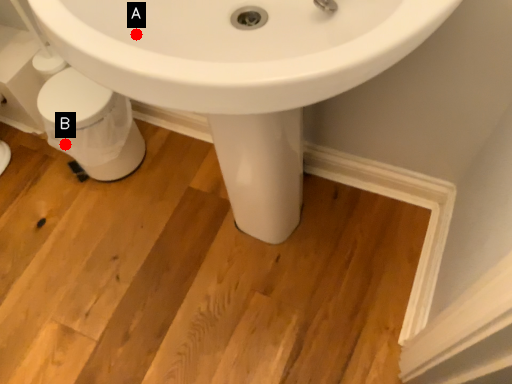
Question: Two points are circled on the image, labeled by A and B beside each circle. Which point is closer to the camera?

Choices:
 (A) A is closer
 (B) B is closer

Answer: (A)